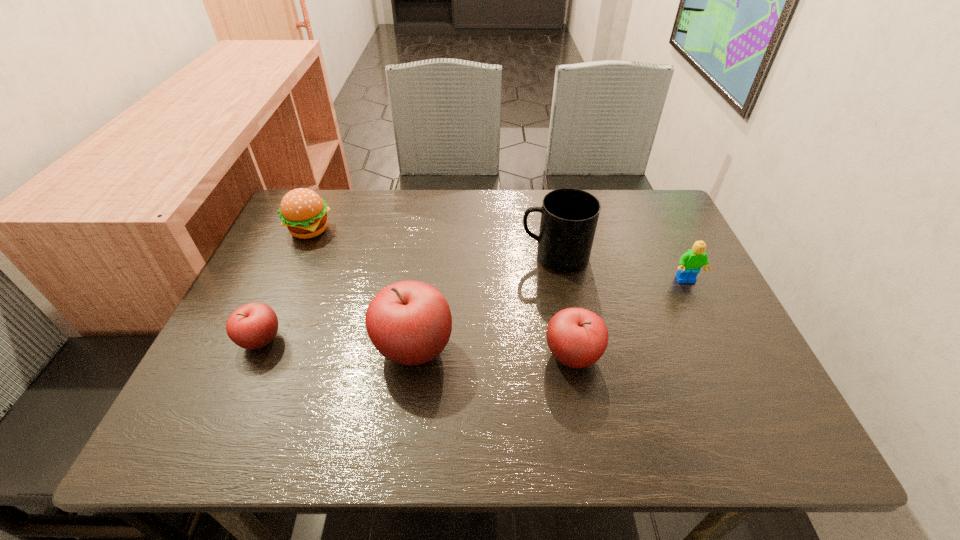
You are a GUI agent. You are given a task and a screenshot of the screen. Output one action in this format:
    pyautogui.click(x=<x>, y=<y>)
    Task: Click on the hamburger at the left edge
    Image resolution: width=960 pixels, height=540 pixels.
    Given the screenshot: What is the action you would take?
    pyautogui.click(x=303, y=211)

The width and height of the screenshot is (960, 540). I want to click on object that is at the right edge, so click(x=690, y=262).

Locate an element on the screen. The height and width of the screenshot is (540, 960). object at the far left corner is located at coordinates (303, 211).

Locate an element on the screen. This screenshot has width=960, height=540. vacant space at the far edge of the desktop is located at coordinates (446, 214).

Locate an element on the screen. free space at the near edge of the desktop is located at coordinates pos(378,381).

Image resolution: width=960 pixels, height=540 pixels. Find the location of `vacant area at the left edge of the desktop`. vacant area at the left edge of the desktop is located at coordinates (327, 248).

Find the location of `vacant space at the far left corner`. vacant space at the far left corner is located at coordinates (335, 224).

At what (x,y) coordinates should I click in order to perform the action: click on vacant region at the near left corner of the desktop. Please return your answer as a coordinate pair (x, y). Looking at the image, I should click on (284, 375).

Identify the location of vacant area at the far right corner of the desktop. This screenshot has width=960, height=540. (631, 227).

The height and width of the screenshot is (540, 960). Identify the location of free space that is in between the third object from left to right and the mug. (485, 302).